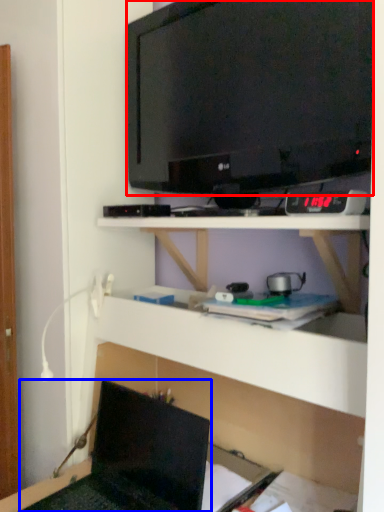
Question: Which point is further to the camera, television (highlighted by a red box) or laptop (highlighted by a blue box)?

Choices:
 (A) television
 (B) laptop

Answer: (A)